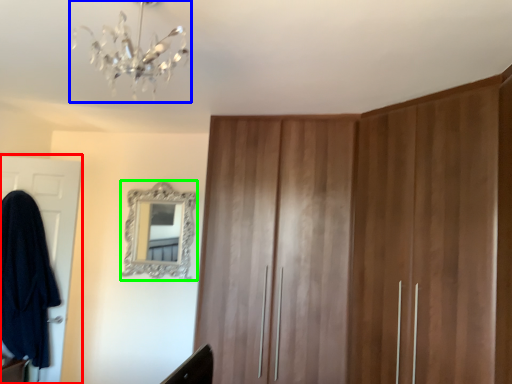
Question: Which object is positioned farthest from door (highlighted by a red box)? Select from light fixture (highlighted by a blue box) and mirror (highlighted by a green box).

Choices:
 (A) light fixture
 (B) mirror

Answer: (A)